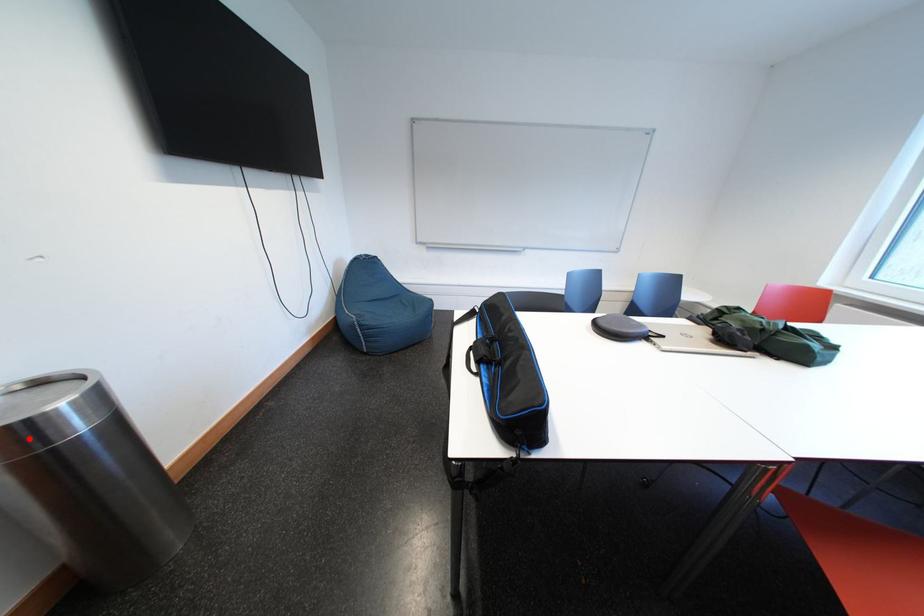
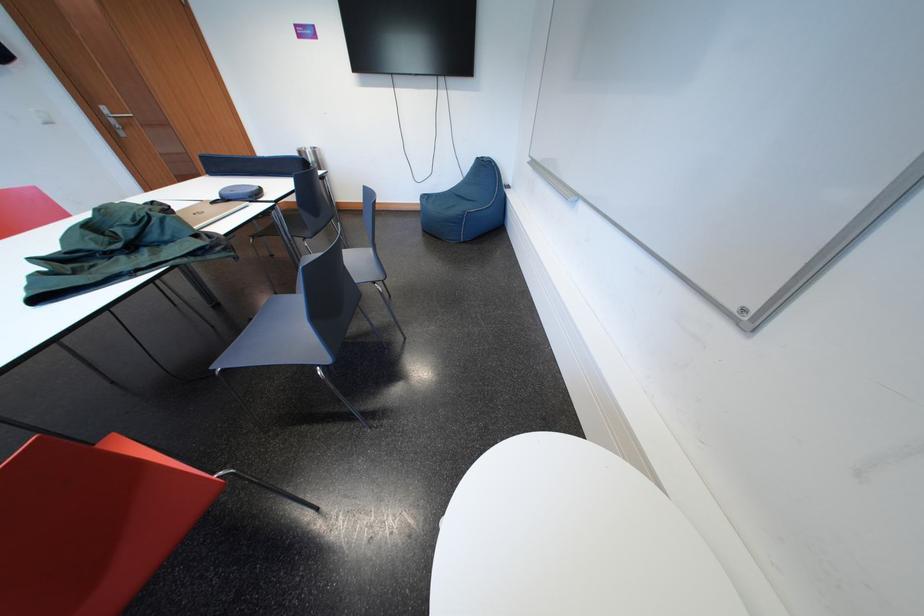
Question: I am providing you with two images of the same scene from different viewpoints. A red point is marked on the first image. At the location where the point appears in image 1, is it still visible in image 2?

Choices:
 (A) Yes
 (B) No

Answer: (A)